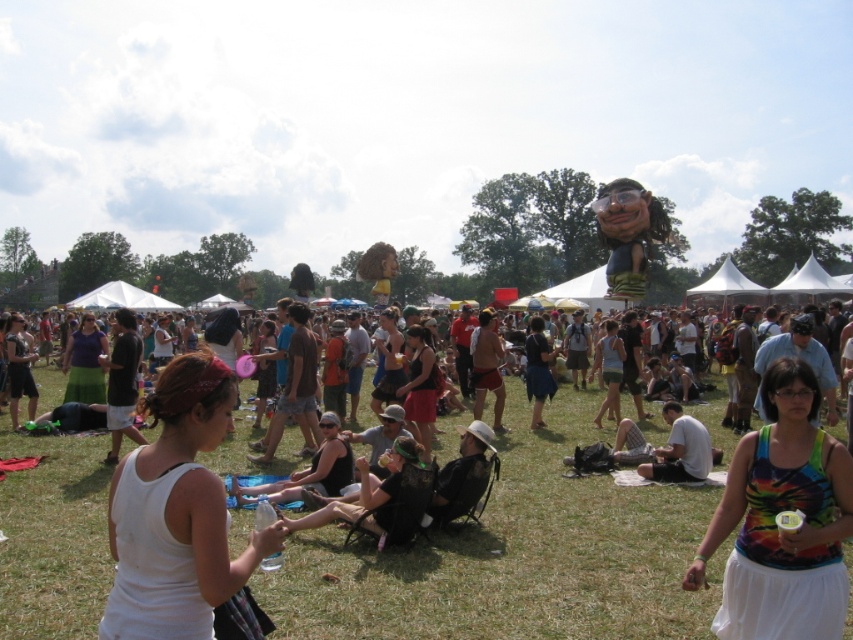
You are at the festival and want to find the white cotton tank top at center. There is a point marked at coordinates (x=776, y=525). Can you tell me where exactly this point is located on the white cotton tank top at center?

The point marked at coordinates (x=776, y=525) is located on the white cotton tank top at center.

You are at the festival and want to find someone wearing a white cotton tank top at center. If you see a matte black tank top at center, which direction should you look relative to it?

The white cotton tank top at center is to the right of the matte black tank top at center, so you should look to the right of the matte black tank top at center to find it.